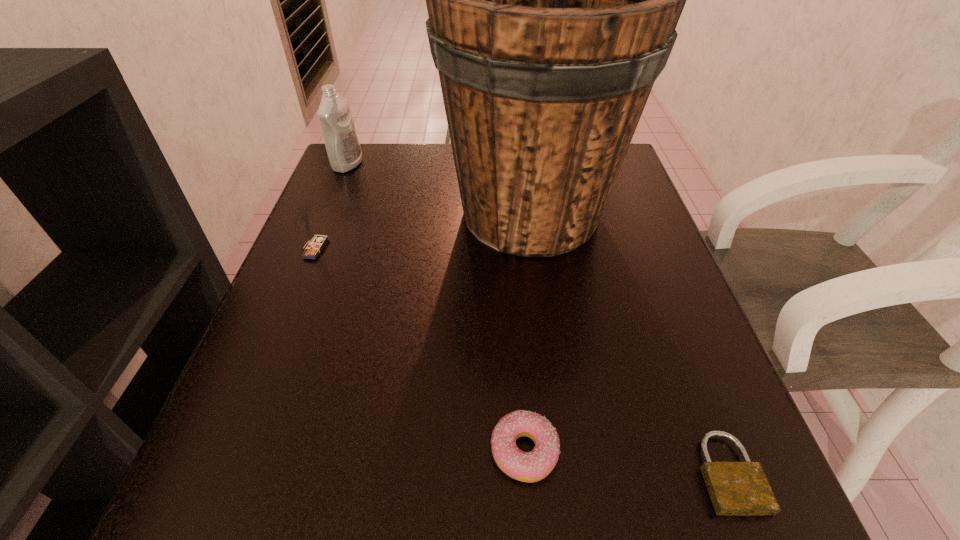
This screenshot has width=960, height=540. I want to click on bucket, so click(x=553, y=0).

The image size is (960, 540). Find the location of `detergent`. detergent is located at coordinates (342, 144).

You are a GUI agent. You are given a task and a screenshot of the screen. Output one action in this format:
    pyautogui.click(x=<x>, y=<y>)
    Task: Click on the matchbox
    This screenshot has height=540, width=960.
    Given the screenshot: What is the action you would take?
    pyautogui.click(x=315, y=246)

The image size is (960, 540). Identify the location of doughnut. (533, 466).

You are a GUI agent. You are given a task and a screenshot of the screen. Output one action in this format:
    pyautogui.click(x=<x>, y=<y>)
    Task: Click on the shortest object
    This screenshot has height=540, width=960.
    Given the screenshot: What is the action you would take?
    pyautogui.click(x=736, y=488)

Where is `vacant space located 0.360m on the front of the tallest object`? vacant space located 0.360m on the front of the tallest object is located at coordinates (564, 462).

In order to click on blank space located on the right of the detergent in this screenshot , I will do (393, 165).

At what (x,y) coordinates should I click in order to perform the action: click on vacant region located on the right of the third shortest object. Please return your answer as a coordinate pair (x, y). This screenshot has width=960, height=540. Looking at the image, I should click on (354, 249).

Find the location of `free space located on the right of the fourth tallest object`. free space located on the right of the fourth tallest object is located at coordinates (594, 451).

I want to click on bucket at the far edge, so click(x=553, y=0).